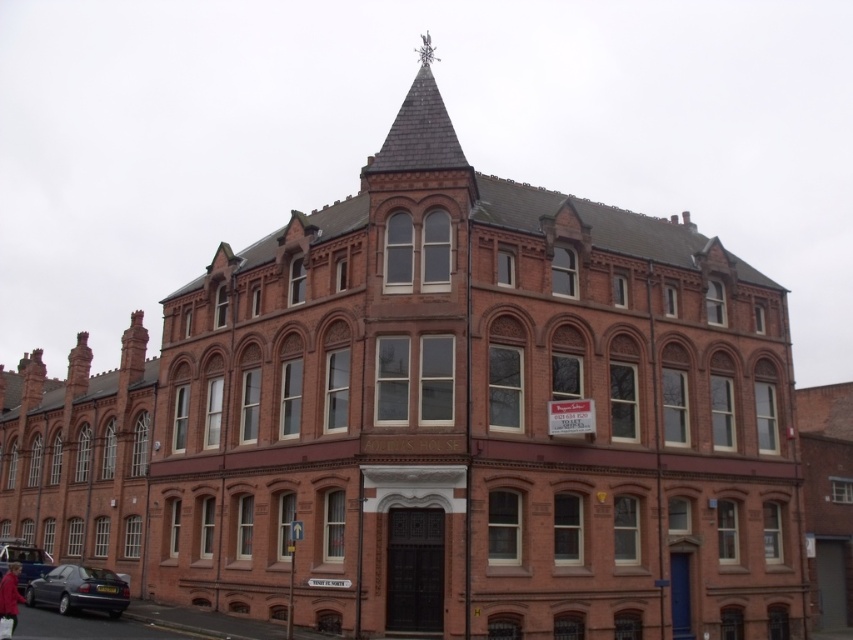
You are a delivery person approaching the shiny slate spire at upper center and the metallic blue sedan at lower left. Which object is higher up in the image?

The shiny slate spire at upper center is higher up in the image than the metallic blue sedan at lower left because it is located above it.

You are a delivery person with a cart that is 3 meters long. You need to park your cart between the metallic blue sedan at lower left and the matte black car at lower left. Is there enough space for your cart?

The distance between the metallic blue sedan at lower left and the matte black car at lower left is 6.84 meters. Since your cart is 3 meters long, there is sufficient space to park it between them.